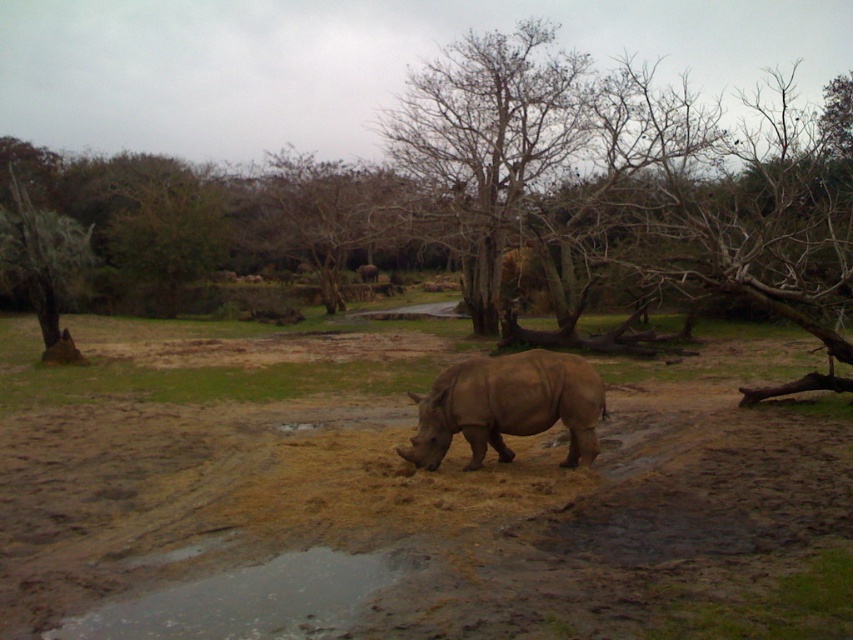
Consider the image. Is brown sandy dirt at center positioned in front of light brown textured rhino at center?

Yes, brown sandy dirt at center is closer to the viewer.

Between brown sandy dirt at center and light brown textured rhino at center, which one appears on the right side from the viewer's perspective?

light brown textured rhino at center is more to the right.

Which is behind, point (20, 618) or point (554, 356)?

The point (554, 356) is more distant.

You are a GUI agent. You are given a task and a screenshot of the screen. Output one action in this format:
    pyautogui.click(x=<x>, y=<y>)
    Task: Click on the brown sandy dirt at center
    
    Given the screenshot: What is the action you would take?
    tap(404, 497)

Does brown sandy dirt at center appear on the left side of brown wood tree at center?

In fact, brown sandy dirt at center is to the right of brown wood tree at center.

Does brown sandy dirt at center appear under brown wood tree at center?

Yes.

You are a GUI agent. You are given a task and a screenshot of the screen. Output one action in this format:
    pyautogui.click(x=<x>, y=<y>)
    Task: Click on the brown sandy dirt at center
    
    Given the screenshot: What is the action you would take?
    pyautogui.click(x=404, y=497)

You are a GUI agent. You are given a task and a screenshot of the screen. Output one action in this format:
    pyautogui.click(x=<x>, y=<y>)
    Task: Click on the brown sandy dirt at center
    This screenshot has width=853, height=640.
    Given the screenshot: What is the action you would take?
    pyautogui.click(x=404, y=497)

Which is above, brown wood tree at center or reflective wet mud at lower center?

Positioned higher is brown wood tree at center.

Does point (252, 104) lie in front of point (71, 634)?

No, it is not.

This screenshot has height=640, width=853. What are the coordinates of `brown wood tree at center` in the screenshot? It's located at (335, 61).